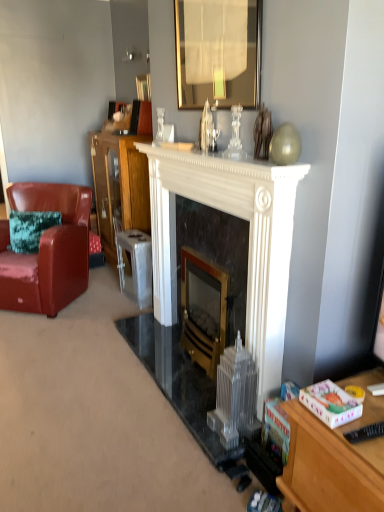
Question: Should I look upward or downward to see wooden cabinet at center?

Choices:
 (A) up
 (B) down

Answer: (A)

Question: Is white marble fireplace at center, the 2th fireplace in the right-to-left sequence, aimed at gold-framed mirror at upper center?

Choices:
 (A) no
 (B) yes

Answer: (A)

Question: Is white marble fireplace at center, the 2th fireplace in the right-to-left sequence, wider than gold-framed mirror at upper center?

Choices:
 (A) no
 (B) yes

Answer: (B)

Question: Is white marble fireplace at center, the 2th fireplace in the right-to-left sequence, oriented away from gold-framed mirror at upper center?

Choices:
 (A) no
 (B) yes

Answer: (A)

Question: Does white marble fireplace at center, acting as the 1th fireplace starting from the left, have a larger size compared to gold-framed mirror at upper center?

Choices:
 (A) no
 (B) yes

Answer: (B)

Question: Considering the relative sizes of white marble fireplace at center, the 2th fireplace in the right-to-left sequence, and gold-framed mirror at upper center in the image provided, is white marble fireplace at center, the 2th fireplace in the right-to-left sequence, taller than gold-framed mirror at upper center?

Choices:
 (A) yes
 (B) no

Answer: (A)

Question: From a real-world perspective, is white marble fireplace at center, acting as the 1th fireplace starting from the left, located beneath gold-framed mirror at upper center?

Choices:
 (A) no
 (B) yes

Answer: (B)

Question: Does wooden cabinet at center have a greater height compared to black marble fireplace at center, the second fireplace from the left?

Choices:
 (A) no
 (B) yes

Answer: (B)

Question: Is wooden cabinet at center positioned far away from black marble fireplace at center, the second fireplace from the left?

Choices:
 (A) no
 (B) yes

Answer: (B)

Question: Is wooden cabinet at center outside of black marble fireplace at center, the second fireplace from the left?

Choices:
 (A) yes
 (B) no

Answer: (A)

Question: Is wooden cabinet at center aimed at black marble fireplace at center, which is the 1th fireplace in right-to-left order?

Choices:
 (A) no
 (B) yes

Answer: (A)

Question: Does wooden cabinet at center have a lesser width compared to black marble fireplace at center, which is the 1th fireplace in right-to-left order?

Choices:
 (A) yes
 (B) no

Answer: (B)

Question: From the image's perspective, does wooden cabinet at center appear lower than black marble fireplace at center, the second fireplace from the left?

Choices:
 (A) no
 (B) yes

Answer: (A)

Question: Would you say black plastic remote control at lower right contains gold-framed mirror at upper center?

Choices:
 (A) yes
 (B) no

Answer: (B)